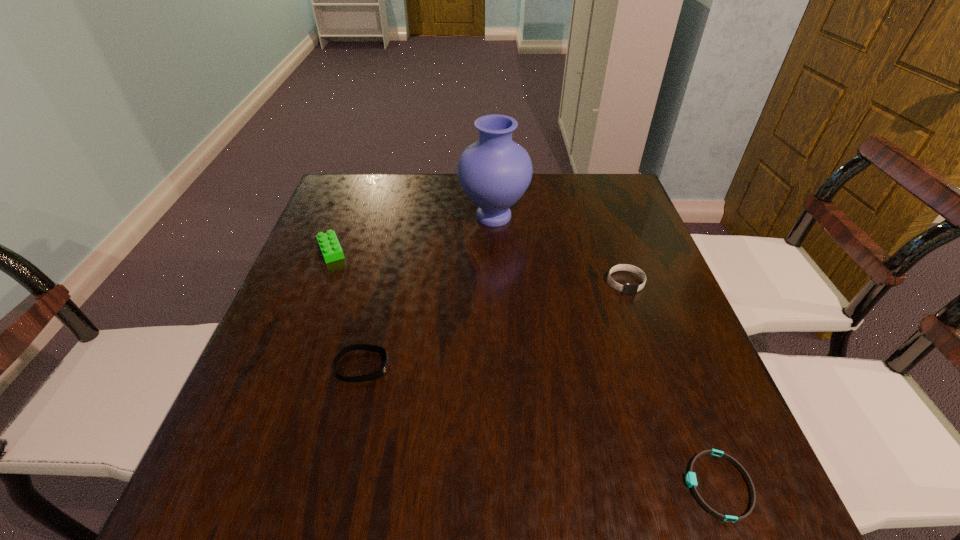
The width and height of the screenshot is (960, 540). What are the coordinates of `vacant position at the far edge of the desktop` in the screenshot? It's located at (528, 189).

Where is `vacant space at the left edge of the desktop`? vacant space at the left edge of the desktop is located at coordinates (360, 259).

This screenshot has height=540, width=960. I want to click on blank space at the right edge of the desktop, so click(x=648, y=277).

In the image, there is a desktop. Identify the location of vacant region at the far left corner. This screenshot has width=960, height=540. (379, 180).

Where is `vacant space that is in between the tallest wristband and the third object from left to right`? This screenshot has height=540, width=960. vacant space that is in between the tallest wristband and the third object from left to right is located at coordinates (560, 249).

Image resolution: width=960 pixels, height=540 pixels. Identify the location of vacant area between the fourth object from right to left and the third nearest object. (494, 325).

The height and width of the screenshot is (540, 960). I want to click on free area in between the leftmost object and the second object from left to right, so click(x=348, y=308).

This screenshot has width=960, height=540. I want to click on empty space between the farthest wristband and the second shortest object, so click(x=494, y=325).

Find the location of a particular element. vacant point located between the nearest object and the third object from left to right is located at coordinates (606, 351).

Locate an element on the screen. This screenshot has height=540, width=960. empty location between the Lego and the farthest wristband is located at coordinates (478, 267).